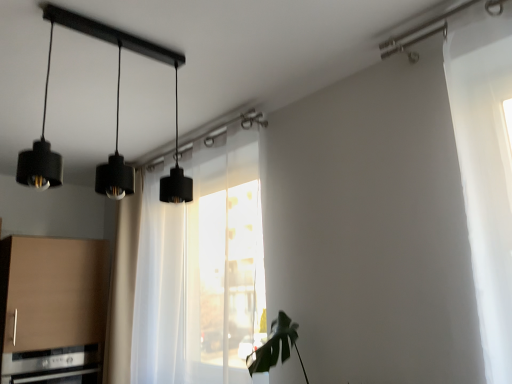
Question: Is satin silver oven at lower left spatially inside matte black pendant light at upper left, or outside of it?

Choices:
 (A) outside
 (B) inside

Answer: (A)

Question: Based on their positions, is satin silver oven at lower left located to the left or right of matte black pendant light at upper left?

Choices:
 (A) right
 (B) left

Answer: (B)

Question: Which of these objects is positioned farthest from the transparent fabric at center?

Choices:
 (A) satin silver oven at lower left
 (B) matte black pendant light at upper left
 (C) matte brown cabinet at lower left

Answer: (A)

Question: Considering the real-world distances, which object is closest to the matte black pendant light at upper left?

Choices:
 (A) satin silver oven at lower left
 (B) matte brown cabinet at lower left
 (C) transparent fabric at center

Answer: (C)